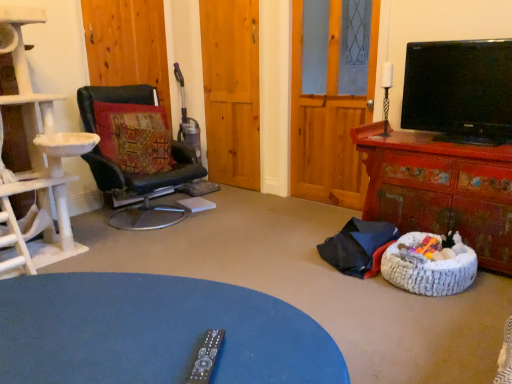
Question: From a real-world perspective, is black leather chair at left below distressed red wooden cabinet at right?

Choices:
 (A) yes
 (B) no

Answer: (B)

Question: Does black leather chair at left have a lesser width compared to distressed red wooden cabinet at right?

Choices:
 (A) yes
 (B) no

Answer: (B)

Question: From a real-world perspective, is black leather chair at left physically above distressed red wooden cabinet at right?

Choices:
 (A) no
 (B) yes

Answer: (B)

Question: From the image's perspective, is black leather chair at left under distressed red wooden cabinet at right?

Choices:
 (A) yes
 (B) no

Answer: (B)

Question: Is black leather chair at left closer to camera compared to distressed red wooden cabinet at right?

Choices:
 (A) yes
 (B) no

Answer: (B)

Question: Is black leather chair at left to the left of distressed red wooden cabinet at right from the viewer's perspective?

Choices:
 (A) no
 (B) yes

Answer: (B)

Question: From a real-world perspective, is distressed red wooden cabinet at right located beneath textured fabric pillow at left?

Choices:
 (A) yes
 (B) no

Answer: (A)

Question: Is distressed red wooden cabinet at right positioned far away from textured fabric pillow at left?

Choices:
 (A) yes
 (B) no

Answer: (A)

Question: Is distressed red wooden cabinet at right further to camera compared to textured fabric pillow at left?

Choices:
 (A) yes
 (B) no

Answer: (B)

Question: Is distressed red wooden cabinet at right at the right side of textured fabric pillow at left?

Choices:
 (A) no
 (B) yes

Answer: (B)

Question: Considering the relative sizes of distressed red wooden cabinet at right and textured fabric pillow at left in the image provided, is distressed red wooden cabinet at right thinner than textured fabric pillow at left?

Choices:
 (A) yes
 (B) no

Answer: (B)

Question: From the image's perspective, is distressed red wooden cabinet at right located beneath textured fabric pillow at left?

Choices:
 (A) yes
 (B) no

Answer: (A)

Question: Is wooden door at center, the first door viewed from the left, placed right next to black leather chair at left?

Choices:
 (A) yes
 (B) no

Answer: (B)